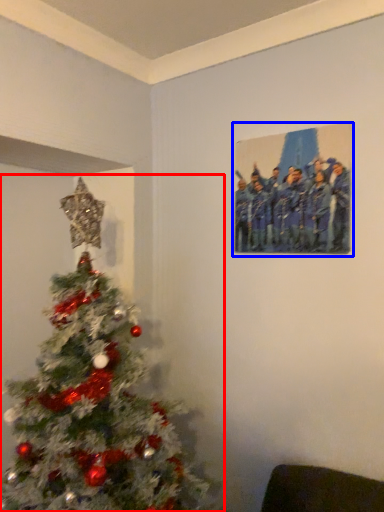
Question: Which point is further to the camera, christmas tree (highlighted by a red box) or picture frame (highlighted by a blue box)?

Choices:
 (A) christmas tree
 (B) picture frame

Answer: (B)